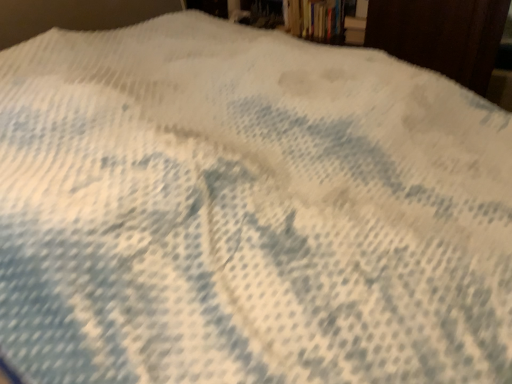
Question: In terms of height, does hardcover book at upper right look taller or shorter compared to hardcover book at upper center?

Choices:
 (A) short
 (B) tall

Answer: (A)

Question: Is hardcover book at upper right inside the boundaries of hardcover book at upper center, or outside?

Choices:
 (A) inside
 (B) outside

Answer: (B)

Question: Is hardcover book at upper right to the left or to the right of hardcover book at upper center in the image?

Choices:
 (A) left
 (B) right

Answer: (B)

Question: Is hardcover book at upper center spatially inside hardcover book at upper right, or outside of it?

Choices:
 (A) inside
 (B) outside

Answer: (B)

Question: Considering their positions, is hardcover book at upper center located in front of or behind hardcover book at upper right?

Choices:
 (A) front
 (B) behind

Answer: (B)

Question: Is hardcover book at upper center wider or thinner than hardcover book at upper right?

Choices:
 (A) wide
 (B) thin

Answer: (A)

Question: Considering the positions of point (293, 26) and point (362, 41), is point (293, 26) closer or farther from the camera than point (362, 41)?

Choices:
 (A) closer
 (B) farther

Answer: (B)